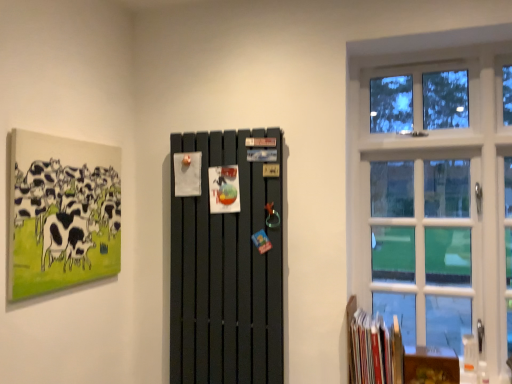
Question: From their relative heights in the image, would you say hardcover books at lower right is taller or shorter than white glass window at right?

Choices:
 (A) tall
 (B) short

Answer: (B)

Question: Relative to white glass window at right, is hardcover books at lower right in front or behind?

Choices:
 (A) front
 (B) behind

Answer: (A)

Question: Which object is positioned farthest from the white glass window at right?

Choices:
 (A) matte black radiator at center
 (B) matte canvas painting of cows at upper left
 (C) hardcover books at lower right

Answer: (B)

Question: Which is farther from the white glass window at right?

Choices:
 (A) hardcover books at lower right
 (B) matte black radiator at center
 (C) matte canvas painting of cows at upper left

Answer: (C)